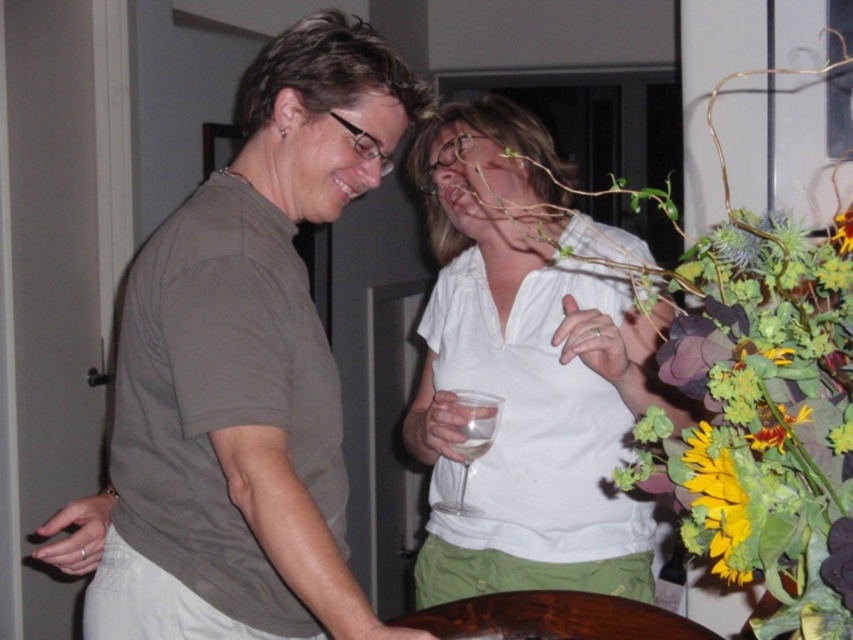
Question: Can you confirm if brown polished wood table at lower center is positioned to the right of yellow matte flower at upper right?

Choices:
 (A) no
 (B) yes

Answer: (A)

Question: From the image, what is the correct spatial relationship of clear glass wine glass at center in relation to yellow matte flower at upper right?

Choices:
 (A) right
 (B) left

Answer: (B)

Question: Which is farther from the clear glass wine glass at center?

Choices:
 (A) brown polished wood table at lower center
 (B) yellow matte flower at lower right
 (C) matte gray t-shirt at center
 (D) white matte shirt at center

Answer: (B)

Question: Which of the following is the farthest from the observer?

Choices:
 (A) clear glass wine glass at center
 (B) yellow matte flower at lower right
 (C) matte gray t-shirt at center
 (D) white matte shirt at center

Answer: (A)

Question: Is brown polished wood table at lower center to the right of clear glass wine glass at center from the viewer's perspective?

Choices:
 (A) yes
 (B) no

Answer: (A)

Question: Which of these objects is positioned farthest from the yellow matte flower at upper right?

Choices:
 (A) matte gray t-shirt at center
 (B) brown polished wood table at lower center
 (C) white matte shirt at center
 (D) yellow matte flower at lower right

Answer: (A)